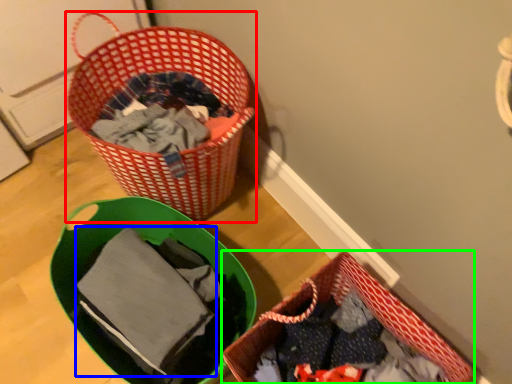
Question: Considering the real-world distances, which object is closest to picnic basket (highlighted by a red box)? baby clothe (highlighted by a blue box) or picnic basket (highlighted by a green box).

Choices:
 (A) baby clothe
 (B) picnic basket

Answer: (A)